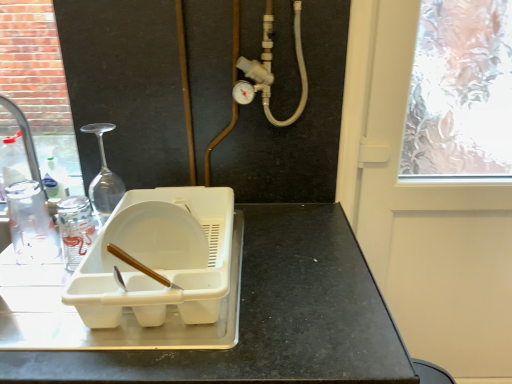
Question: Is white plastic dish rack at center at the back of transparent frosted glass screen door at upper right?

Choices:
 (A) no
 (B) yes

Answer: (A)

Question: Considering the relative sizes of transparent frosted glass screen door at upper right and white plastic dish rack at center in the image provided, is transparent frosted glass screen door at upper right shorter than white plastic dish rack at center?

Choices:
 (A) yes
 (B) no

Answer: (B)

Question: Does transparent frosted glass screen door at upper right appear on the left side of white plastic dish rack at center?

Choices:
 (A) no
 (B) yes

Answer: (A)

Question: From the image's perspective, would you say transparent frosted glass screen door at upper right is positioned over white plastic dish rack at center?

Choices:
 (A) no
 (B) yes

Answer: (A)

Question: Considering the relative sizes of transparent frosted glass screen door at upper right and white plastic dish rack at center in the image provided, is transparent frosted glass screen door at upper right thinner than white plastic dish rack at center?

Choices:
 (A) no
 (B) yes

Answer: (B)

Question: From a real-world perspective, is transparent frosted glass screen door at upper right positioned under white plastic dish rack at center based on gravity?

Choices:
 (A) yes
 (B) no

Answer: (A)

Question: Does white plastic dish rack at center have a greater width compared to transparent frosted glass screen door at upper right?

Choices:
 (A) yes
 (B) no

Answer: (A)

Question: Is white plastic dish rack at center thinner than transparent frosted glass screen door at upper right?

Choices:
 (A) no
 (B) yes

Answer: (A)

Question: Can transparent frosted glass screen door at upper right be found inside white plastic dish rack at center?

Choices:
 (A) no
 (B) yes

Answer: (A)

Question: From the image's perspective, would you say white plastic dish rack at center is shown under transparent frosted glass screen door at upper right?

Choices:
 (A) yes
 (B) no

Answer: (B)

Question: Is white plastic dish rack at center shorter than transparent frosted glass screen door at upper right?

Choices:
 (A) yes
 (B) no

Answer: (A)

Question: From the image's perspective, is white plastic dish rack at center located above transparent frosted glass screen door at upper right?

Choices:
 (A) yes
 (B) no

Answer: (A)

Question: From a real-world perspective, is white plastic tray at center physically below clear plastic bottle at left?

Choices:
 (A) no
 (B) yes

Answer: (B)